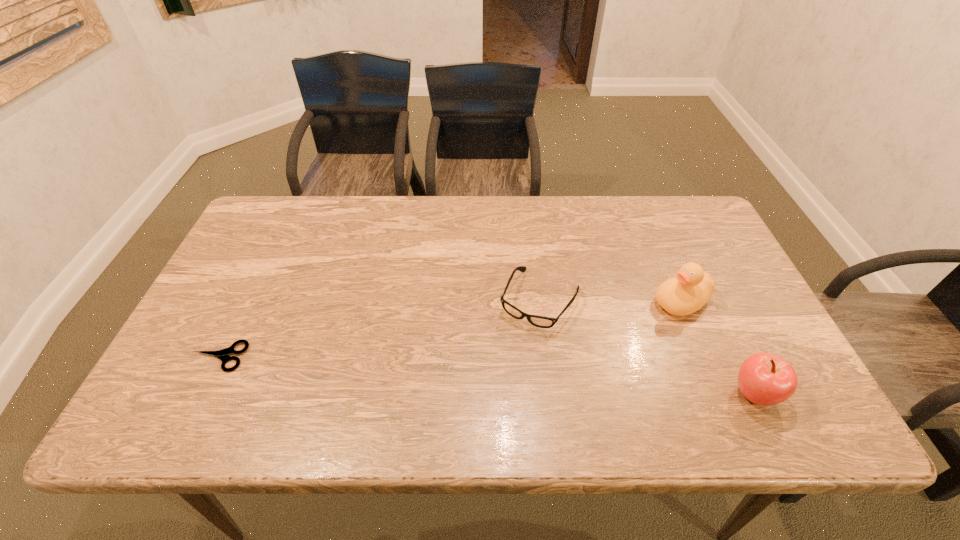
Locate an element on the screen. free space between the apple and the leftmost object is located at coordinates (487, 375).

At what (x,y) coordinates should I click in order to perform the action: click on free spot between the leftmost object and the duck. Please return your answer as a coordinate pair (x, y). This screenshot has width=960, height=540. Looking at the image, I should click on (450, 329).

Locate an element on the screen. This screenshot has height=540, width=960. free area in between the leftmost object and the duck is located at coordinates (450, 329).

Locate an element on the screen. The height and width of the screenshot is (540, 960). vacant area that lies between the second object from left to right and the nearest object is located at coordinates (647, 347).

Find the location of `free space between the duck and the spectacles`. free space between the duck and the spectacles is located at coordinates (611, 301).

Locate an element on the screen. vacant space that's between the duck and the shears is located at coordinates (450, 329).

I want to click on free space between the leftmost object and the duck, so click(x=450, y=329).

At what (x,y) coordinates should I click in order to perform the action: click on object that is the second closest one to the second nearest object. Please return your answer as a coordinate pair (x, y). Looking at the image, I should click on (691, 288).

Identify which object is the third closest to the leftmost object. Please provide its 2D coordinates. Your answer should be formatted as a tuple, i.e. [(x, y)], where the tuple contains the x and y coordinates of a point satisfying the conditions above.

[(765, 379)]

I want to click on free space that satisfies the following two spatial constraints: 1. on the back side of the third object from right to left; 2. on the right side of the shears, so click(247, 299).